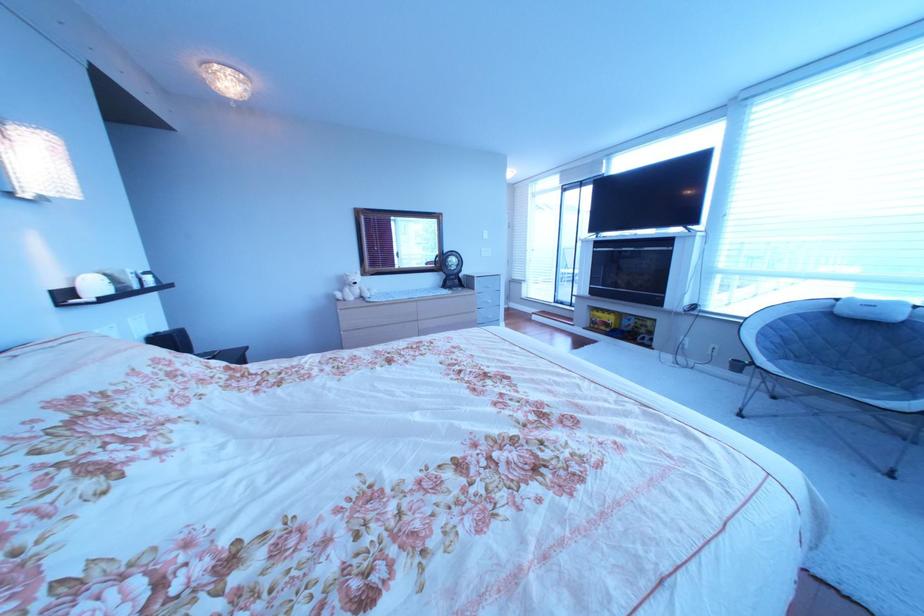
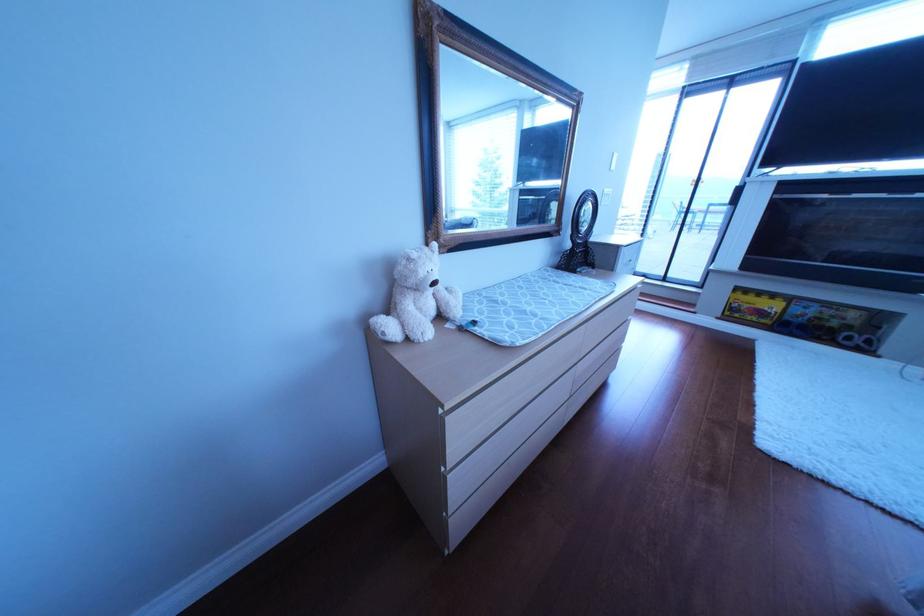
Locate, in the second image, the point that corresponds to pixel 599 330 in the first image.

(733, 320)